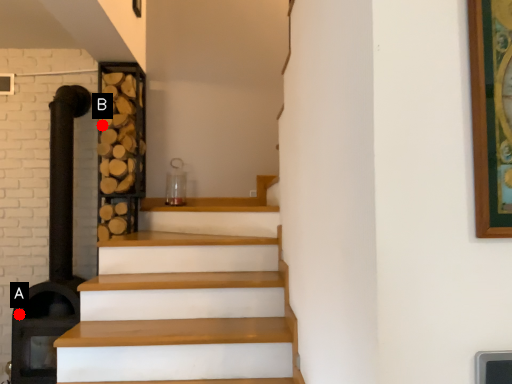
Question: Two points are circled on the image, labeled by A and B beside each circle. Which point is closer to the camera?

Choices:
 (A) A is closer
 (B) B is closer

Answer: (A)